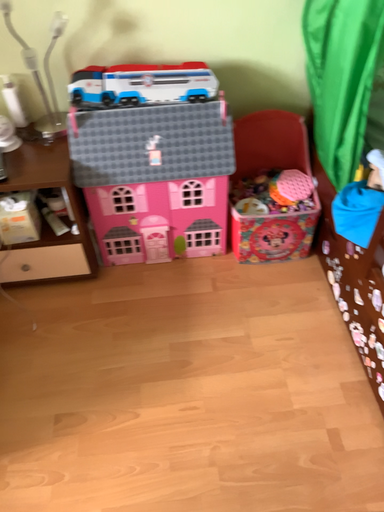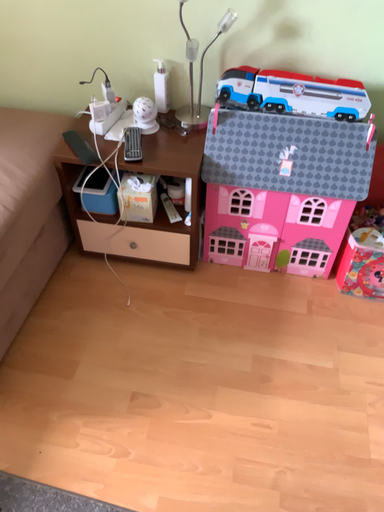
Question: Which way did the camera rotate in the video?

Choices:
 (A) rotated left
 (B) rotated right

Answer: (A)